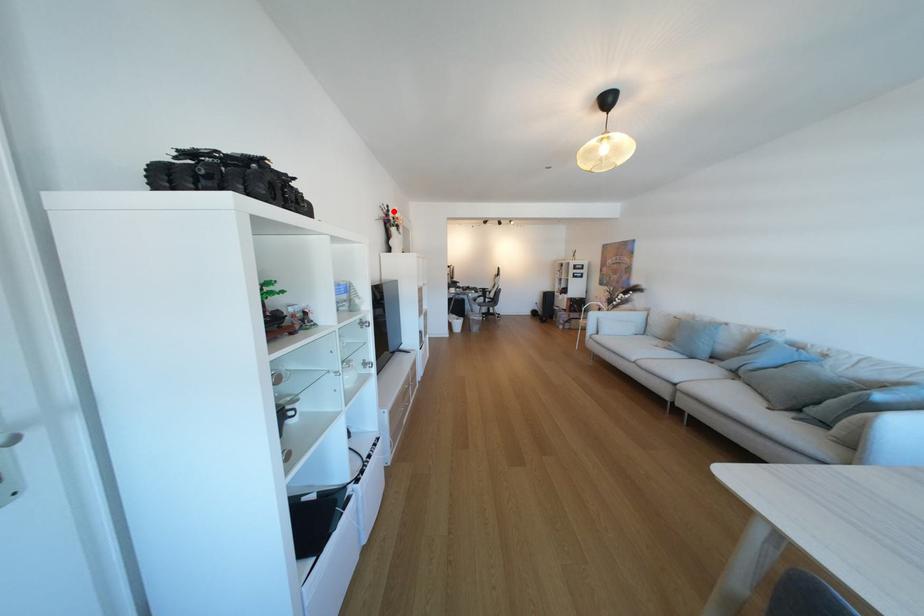
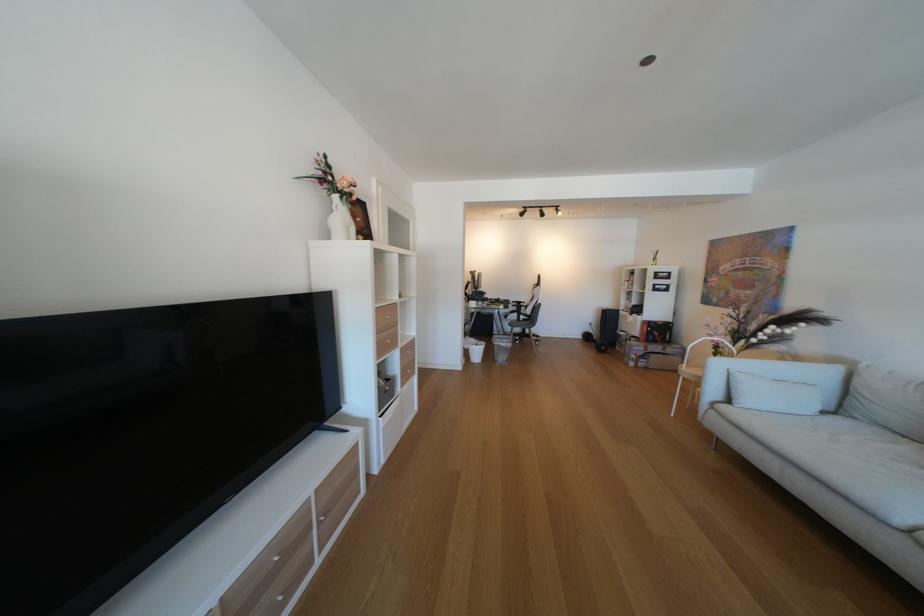
In the second image, find the point that corresponds to the highlighted location in the first image.

(331, 166)